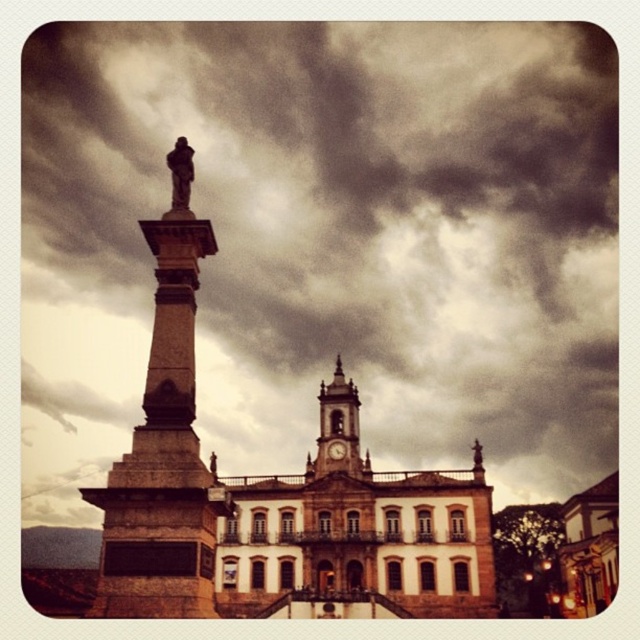
You are a tourist standing in the square and want to take a photo of both the brown stone obelisk at left and the golden stone clock tower at center. Which object should you position closer to the camera to include both in the frame?

The brown stone obelisk at left is positioned over the golden stone clock tower at center, so you should position the brown stone obelisk at left closer to the camera to include both in the frame.

What is the object located at the coordinates point (x=337, y=429) in the image?

The point (x=337, y=429) corresponds to the golden stone clock tower at center.

Based on the coordinates provided, which object corresponds to the point at (163, 458)?

The point at (163, 458) corresponds to the brown stone obelisk at left.